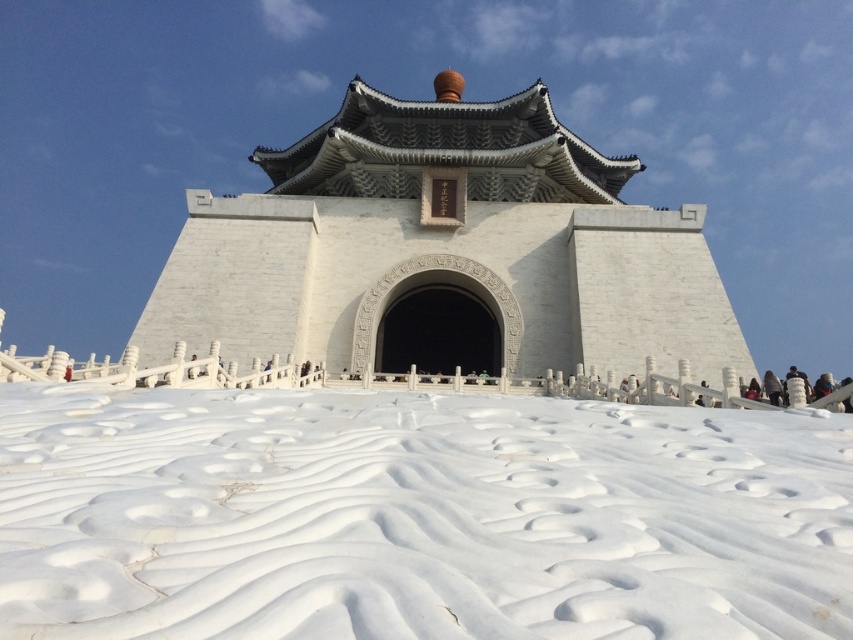
You are an architect visiting the monument and want to take a photo of the white textured snow at lower center and the white stone temple at center. Which object should you focus on first if you want to capture both in a single frame without moving the camera?

The white textured snow at lower center is smaller than the white stone temple at center, so you should focus on the white stone temple at center first to ensure it fits properly in the frame.

You are standing in front of the grand architectural structure and notice a specific point marked at coordinates (x=416, y=516). What is the object located at this point?

The white textured snow at lower center is located at point (x=416, y=516).

You are standing at the entrance of the monument and want to walk towards the point labeled as point (589,284). Which direction should you move relative to the other point, point (608,573)?

Point (608,573) is in front of point (589,284). To reach point (589,284) from the entrance, you should move behind the point (608,573).